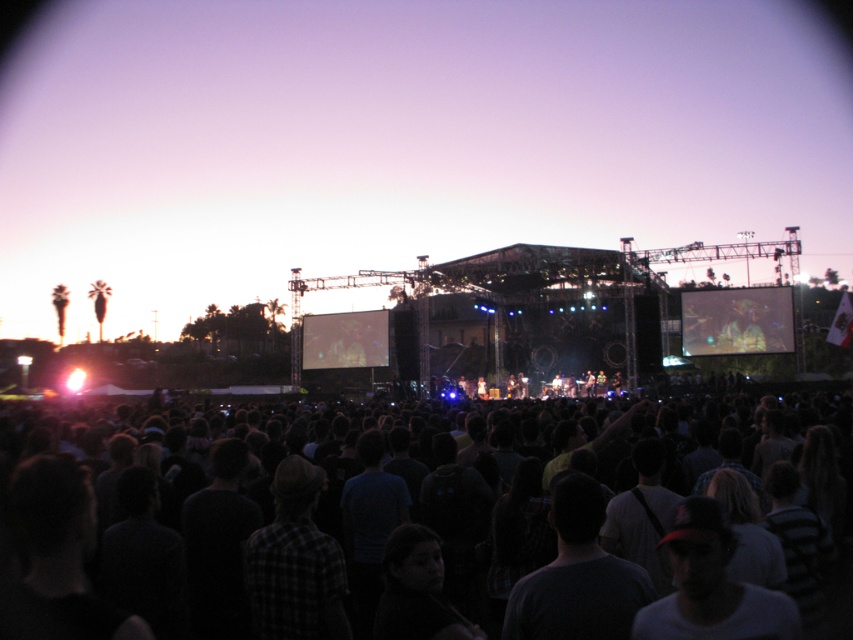
You are a photographer positioned at the camera location. You want to capture a photo of the matte black screen at center during the concert. Given that your camera has a maximum focus range of 130 meters, will you be able to focus on the screen?

The matte black screen at center and camera are 137.70 meters apart from each other. Since the distance exceeds the camera maximum focus range of 130 meters, you won not be able to focus on the matte black screen at center.

From the picture: You are a photographer trying to capture a clear shot of the dark casual clothing at center and the matte black screen at center from the front of the crowd. Considering their heights, which one will appear taller in your photo?

The dark casual clothing at center is taller than the matte black screen at center, so it will appear taller in the photo.